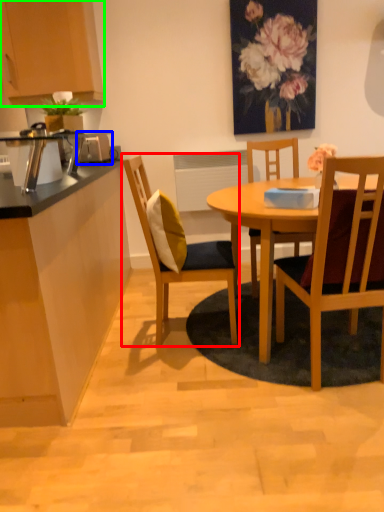
Question: Which object is positioned closest to chair (highlighted by a red box)? Select from appliance (highlighted by a blue box) and cabinetry (highlighted by a green box).

Choices:
 (A) appliance
 (B) cabinetry

Answer: (A)